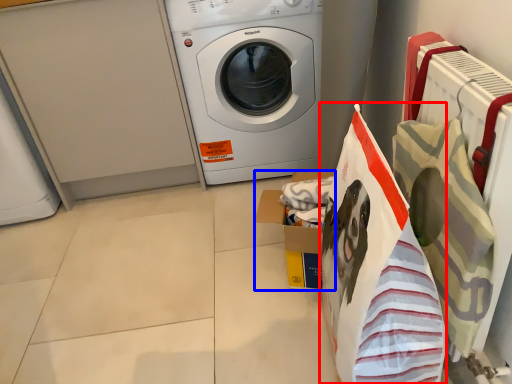
Question: Which object is closer to the camera taking this photo, shopping bag (highlighted by a red box) or cardboard box (highlighted by a blue box)?

Choices:
 (A) shopping bag
 (B) cardboard box

Answer: (A)